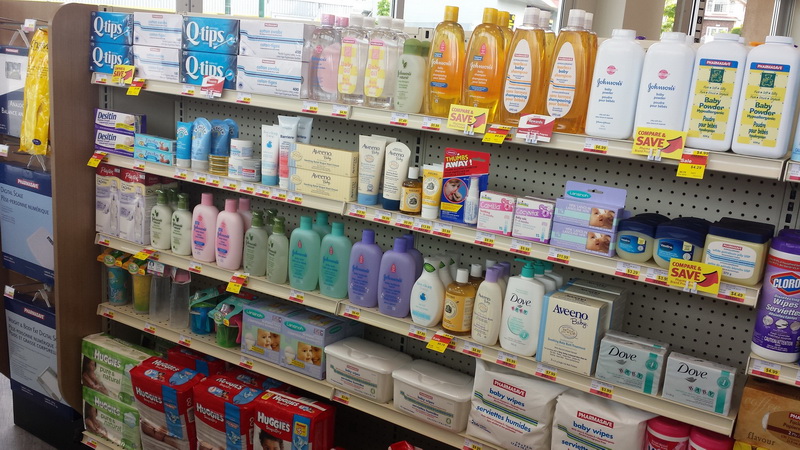
Identify the location of floor. (18, 440).